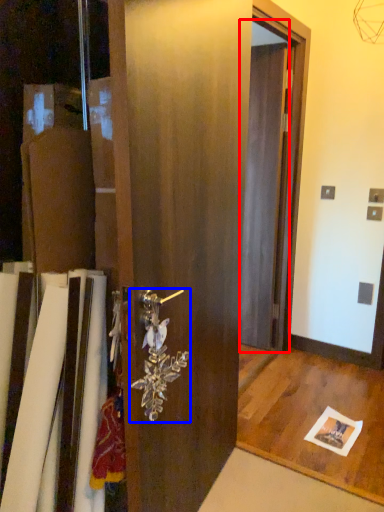
Question: Which point is further to the camera, screen door (highlighted by a red box) or door handle (highlighted by a blue box)?

Choices:
 (A) screen door
 (B) door handle

Answer: (A)